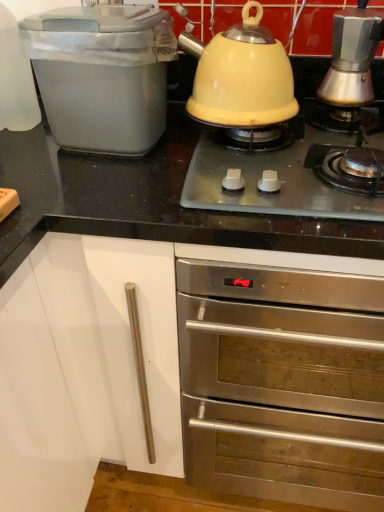
Question: Is point (259, 70) positioned closer to the camera than point (345, 67)?

Choices:
 (A) farther
 (B) closer

Answer: (B)

Question: Is yellow matte kettle at center in front of or behind silver metallic espresso maker at upper right, the 1th kitchen appliance viewed from the right, in the image?

Choices:
 (A) front
 (B) behind

Answer: (A)

Question: Which is farther from the yellow matte kettle at center?

Choices:
 (A) stainless steel oven at upper center
 (B) matte plastic bread bin at left, acting as the 2th kitchen appliance starting from the right
 (C) yellow enameled kettle at upper center
 (D) silver metallic espresso maker at upper right, the second kitchen appliance viewed from the left

Answer: (A)

Question: Which is nearer to the silver metallic espresso maker at upper right, the 1th kitchen appliance viewed from the right?

Choices:
 (A) stainless steel oven at upper center
 (B) yellow matte kettle at center
 (C) matte plastic bread bin at left, the 1th kitchen appliance viewed from the left
 (D) yellow enameled kettle at upper center

Answer: (B)